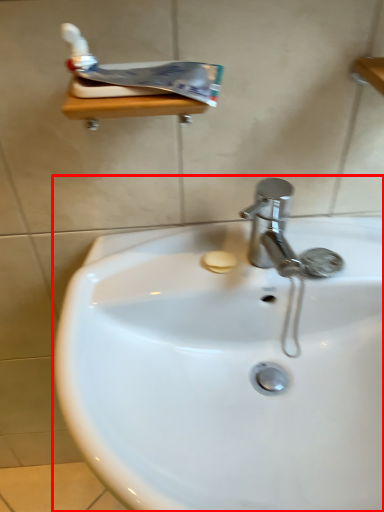
Question: In this image, where is sink (annotated by the red box) located relative to toothpaste?

Choices:
 (A) left
 (B) right

Answer: (B)